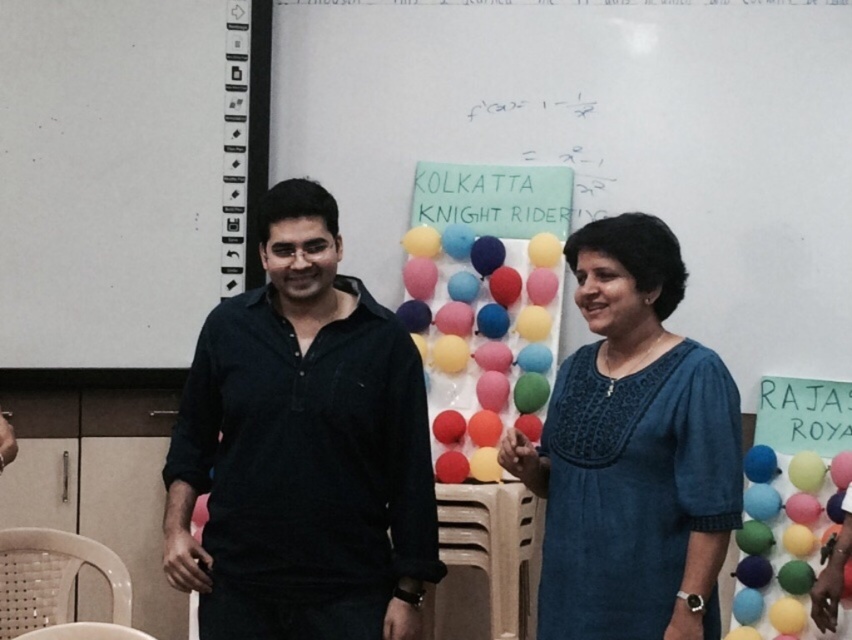
You are at the center of the room and see the colorful balloons at center and the blue cotton dress at center. Which object is located to the right side from your perspective?

The colorful balloons at center are located to the right of the blue cotton dress at center, so from your perspective at the center of the room, the colorful balloons at center are on the right side.

You are organizing a classroom and need to place a new poster on the wall. The poster is the size of the white paper at upper left. Is there enough space on the wall next to the black cotton shirt at center?

The black cotton shirt at center is larger in size than the white paper at upper left. Since the poster is the same size as the white paper at upper left, there should be enough space on the wall next to the black cotton shirt at center as the shirt is bigger and likely occupies more space, leaving room for the poster.